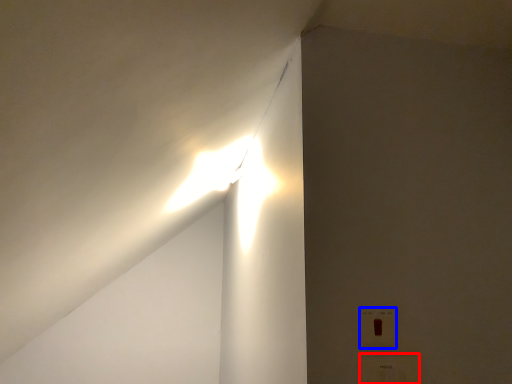
Question: Which object is closer to the camera taking this photo, electric outlet (highlighted by a red box) or electric outlet (highlighted by a blue box)?

Choices:
 (A) electric outlet
 (B) electric outlet

Answer: (A)